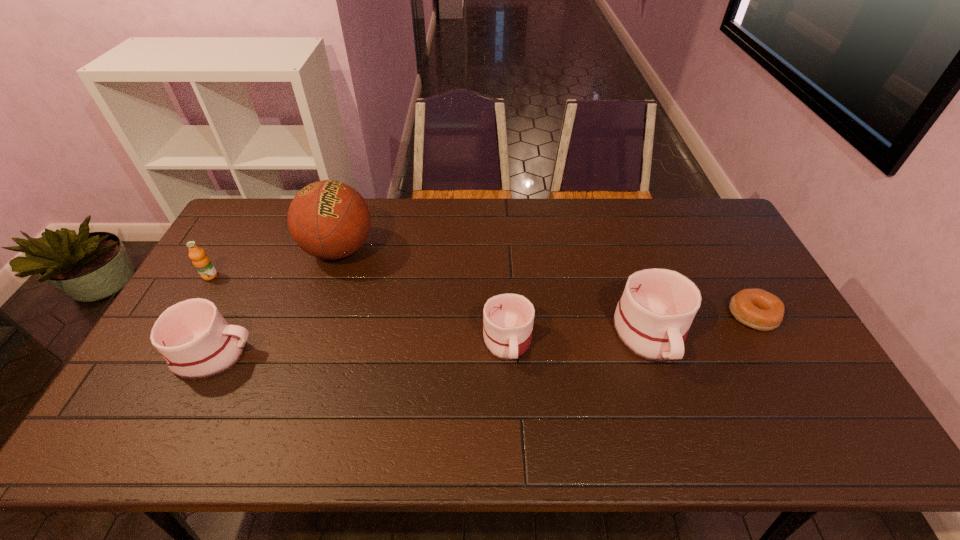
I want to click on object located at the near left corner, so click(195, 340).

Find the location of `vacant space at the far edge`. vacant space at the far edge is located at coordinates (469, 218).

In the image, there is a desktop. Where is `vacant area at the near edge`? vacant area at the near edge is located at coordinates (530, 388).

Where is `free region at the right edge of the desktop`? free region at the right edge of the desktop is located at coordinates (707, 250).

The image size is (960, 540). In the image, there is a desktop. Find the location of `blank space at the far left corner`. blank space at the far left corner is located at coordinates (268, 199).

At what (x,y) coordinates should I click in order to perform the action: click on vacant space at the far right corner of the desktop. Please return your answer as a coordinate pair (x, y). Image resolution: width=960 pixels, height=540 pixels. Looking at the image, I should click on (701, 228).

This screenshot has width=960, height=540. I want to click on vacant space that is in between the bagel and the second object from right to left, so click(x=701, y=325).

Locate an element on the screen. vacant space in between the tallest object and the leftmost mug is located at coordinates (276, 302).

At what (x,y) coordinates should I click in order to perform the action: click on vacant point located between the third object from left to right and the second tallest mug. Please return your answer as a coordinate pair (x, y). Looking at the image, I should click on point(276,302).

Locate an element on the screen. This screenshot has height=540, width=960. free point between the basketball and the fifth object from left to right is located at coordinates (494, 292).